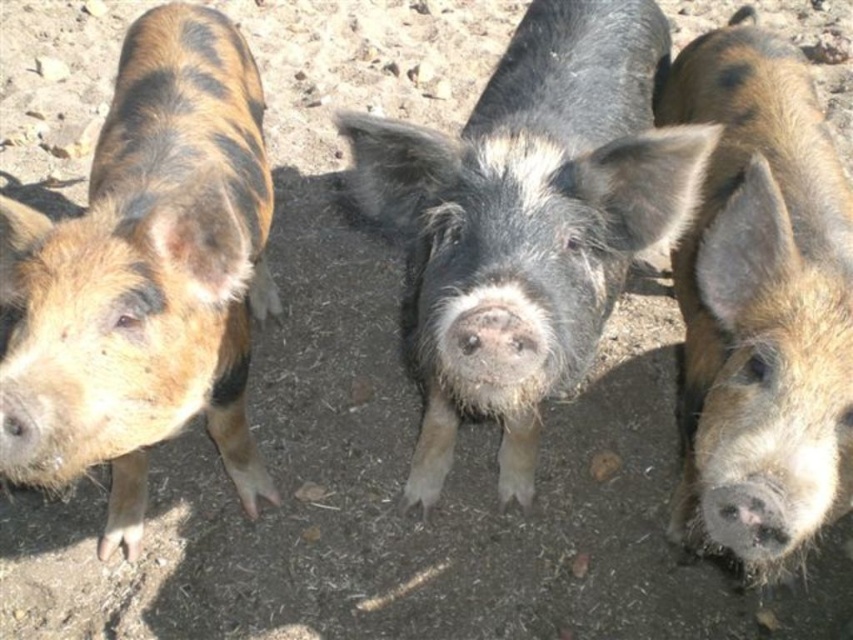
You are a farmer observing three pigs in a pen. You notice the brown speckled fur at left and the brown speckled pig at center. Which one is located more to the left?

The brown speckled fur at left is more to the left than the brown speckled pig at center.

From the picture: You are a farmer who wants to build a fence around the black fuzzy pig at center and the brown speckled pig at center. Since the pigs are next to each other, which pig requires a wider fence to accommodate its size?

The black fuzzy pig at center requires a wider fence because its width is larger than the brown speckled pig at center.

In the scene shown: You are a farmer checking the pigs in the pen. You notice the black fuzzy pig at center and the brown speckled fur at left. Which pig is positioned higher in the image?

The black fuzzy pig at center is positioned higher in the image than the brown speckled fur at left.